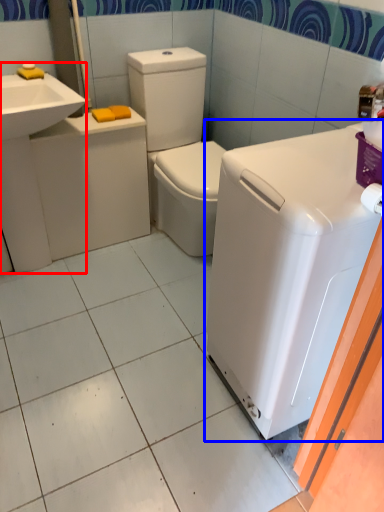
Question: Which point is further to the camera, sink (highlighted by a red box) or washing machine (highlighted by a blue box)?

Choices:
 (A) sink
 (B) washing machine

Answer: (A)